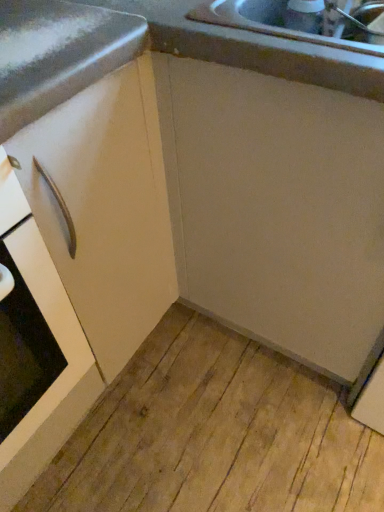
Where is `matte white cabinet at center`? matte white cabinet at center is located at coordinates (75, 219).

Based on the photo, what is the approximate width of matte white cabinet at center?

24.68 inches.

This screenshot has height=512, width=384. What do you see at coordinates (75, 219) in the screenshot? I see `matte white cabinet at center` at bounding box center [75, 219].

Describe the element at coordinates (54, 343) in the screenshot. I see `white matte cabinet handle at left` at that location.

The image size is (384, 512). Identify the location of white matte cabinet handle at left. (54, 343).

Identify the location of matte white cabinet at center. (75, 219).

Between white matte cabinet handle at left and matte white cabinet at center, which one appears on the right side from the viewer's perspective?

From the viewer's perspective, matte white cabinet at center appears more on the right side.

Does white matte cabinet handle at left come in front of matte white cabinet at center?

Yes, it is.

Is point (67, 313) behind point (108, 325)?

No, (67, 313) is in front of (108, 325).

From the image's perspective, which is above, white matte cabinet handle at left or matte white cabinet at center?

matte white cabinet at center, from the image's perspective.

From a real-world perspective, which is physically below, white matte cabinet handle at left or matte white cabinet at center?

white matte cabinet handle at left is physically lower.

Can you confirm if white matte cabinet handle at left is wider than matte white cabinet at center?

No.

Is white matte cabinet handle at left taller or shorter than matte white cabinet at center?

In the image, white matte cabinet handle at left appears to be shorter than matte white cabinet at center.

Considering the relative sizes of white matte cabinet handle at left and matte white cabinet at center in the image provided, is white matte cabinet handle at left bigger than matte white cabinet at center?

No, white matte cabinet handle at left is not bigger than matte white cabinet at center.

Is white matte cabinet handle at left located outside matte white cabinet at center?

Yes.

Are white matte cabinet handle at left and matte white cabinet at center located far from each other?

white matte cabinet handle at left is near matte white cabinet at center, not far away.

Could you tell me if white matte cabinet handle at left is turned towards matte white cabinet at center?

No, white matte cabinet handle at left does not turn towards matte white cabinet at center.

How many degrees apart are the facing directions of white matte cabinet handle at left and matte white cabinet at center?

The angular difference between white matte cabinet handle at left and matte white cabinet at center is 0.414 degrees.

Find the location of a particular element. The width and height of the screenshot is (384, 512). home appliance located in front of the matte white cabinet at center is located at coordinates (54, 343).

Between matte white cabinet at center and white matte cabinet handle at left, which one appears on the left side from the viewer's perspective?

From the viewer's perspective, white matte cabinet handle at left appears more on the left side.

Which is behind, matte white cabinet at center or white matte cabinet handle at left?

matte white cabinet at center is further away from the camera.

Which is nearer, [13,170] or [34,411]?

Point [13,170] is positioned closer to the camera compared to point [34,411].

From the image's perspective, between matte white cabinet at center and white matte cabinet handle at left, who is located below?

From the image's view, white matte cabinet handle at left is below.

From a real-world perspective, is matte white cabinet at center positioned above or below white matte cabinet handle at left?

Clearly, from a real-world perspective, matte white cabinet at center is above white matte cabinet handle at left.

Considering the relative sizes of matte white cabinet at center and white matte cabinet handle at left in the image provided, is matte white cabinet at center thinner than white matte cabinet handle at left?

No.

From their relative heights in the image, would you say matte white cabinet at center is taller or shorter than white matte cabinet handle at left?

In the image, matte white cabinet at center appears to be taller than white matte cabinet handle at left.

Considering the sizes of objects matte white cabinet at center and white matte cabinet handle at left in the image provided, who is bigger, matte white cabinet at center or white matte cabinet handle at left?

Bigger between the two is matte white cabinet at center.

Can white matte cabinet handle at left be found inside matte white cabinet at center?

No, white matte cabinet handle at left is not surrounded by matte white cabinet at center.

Based on the photo, can you see matte white cabinet at center touching white matte cabinet handle at left?

Absolutely, matte white cabinet at center is next to and touching white matte cabinet handle at left.

Is white matte cabinet handle at left at the back of matte white cabinet at center?

No, white matte cabinet handle at left is not at the back of matte white cabinet at center.

How many degrees apart are the facing directions of matte white cabinet at center and white matte cabinet handle at left?

matte white cabinet at center and white matte cabinet handle at left are facing 0.414 degrees away from each other.

Identify the location of cabinetry above the white matte cabinet handle at left (from the image's perspective). (75, 219).

Locate an element on the screen. This screenshot has width=384, height=512. home appliance below the matte white cabinet at center (from the image's perspective) is located at coordinates (54, 343).

Locate an element on the screen. This screenshot has width=384, height=512. home appliance lying on the left of matte white cabinet at center is located at coordinates (54, 343).